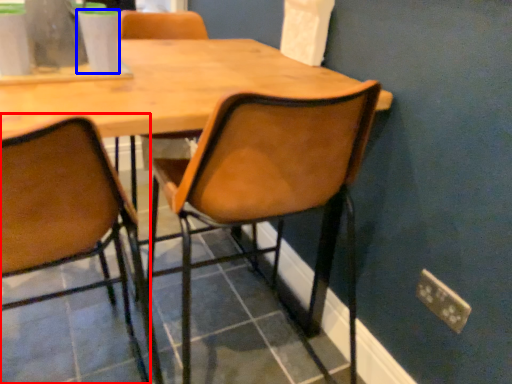
Question: Which of the following is the farthest to the observer, chair (highlighted by a red box) or coffee cup (highlighted by a blue box)?

Choices:
 (A) chair
 (B) coffee cup

Answer: (B)